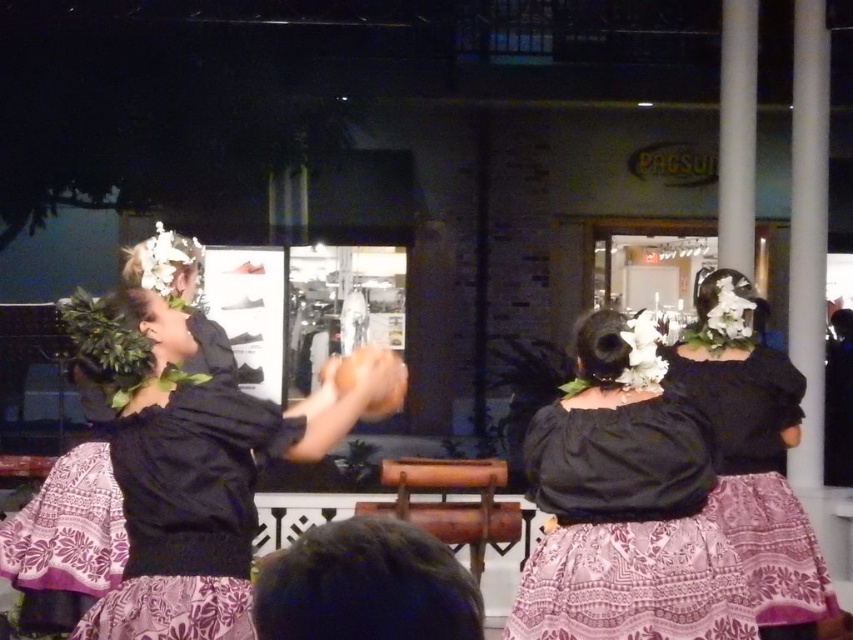
Is matte black blouse at center shorter than purple printed dress at center?

No.

Does matte black blouse at center have a greater height compared to purple printed dress at center?

Yes, matte black blouse at center is taller than purple printed dress at center.

Find the location of a particular element. matte black blouse at center is located at coordinates (624, 504).

Which of these two, purple printed dress at center or black matte dress at upper center, stands shorter?

purple printed dress at center is shorter.

I want to click on purple printed dress at center, so click(189, 512).

Can you confirm if matte black blouse at center is positioned above black matte dress at upper center?

No.

Can you confirm if matte black blouse at center is thinner than black matte dress at upper center?

Correct, matte black blouse at center's width is less than black matte dress at upper center's.

Is point (619, 563) positioned in front of point (790, 560)?

Yes, it is in front of point (790, 560).

The image size is (853, 640). What are the coordinates of `matte black blouse at center` in the screenshot? It's located at coord(624,504).